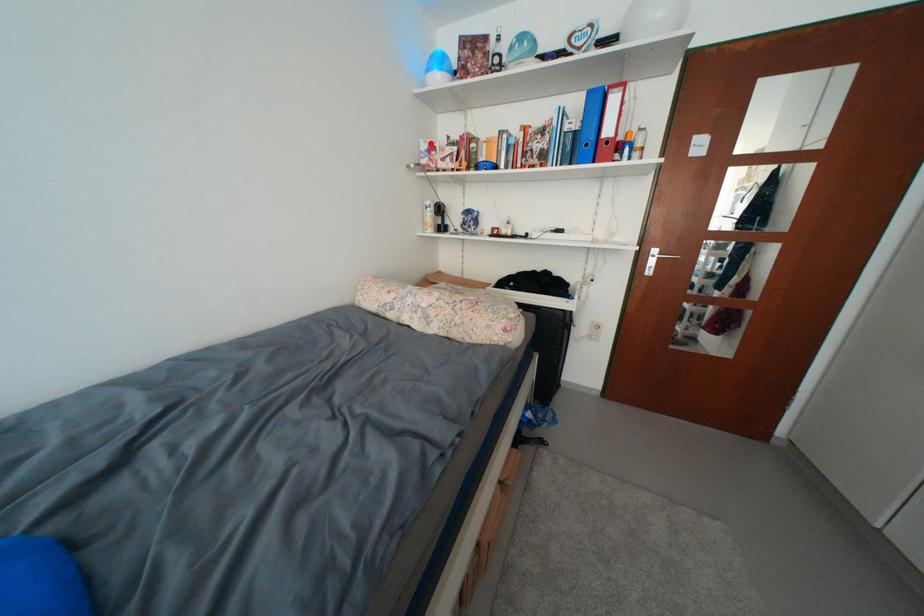
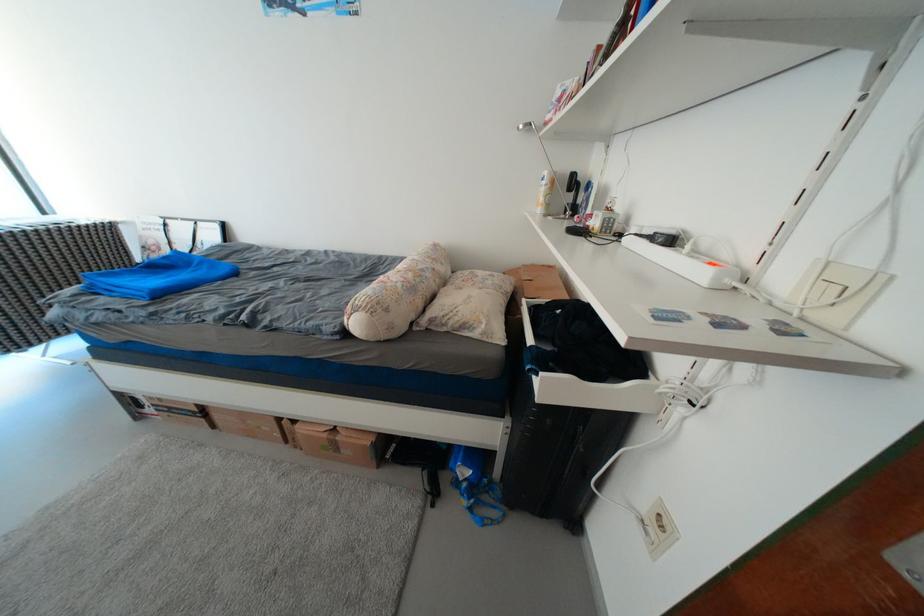
The point at the highlighted location is marked in the first image. Where is the corresponding point in the second image?

(567, 89)